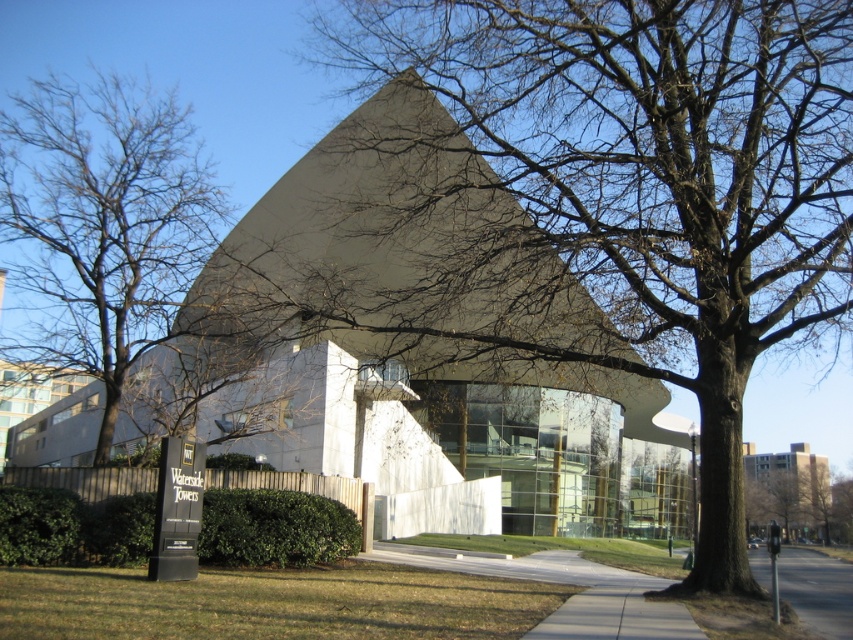
You are a delivery person trying to find the entrance to Waterside Towers. You see the brown textured tree at center and the gray asphalt at lower right. Which object is closer to you?

The brown textured tree at center is closer to you since the gray asphalt at lower right is behind it.

You are a visitor arriving at Waterside Towers and want to park your car on the gray asphalt at lower right. However, there is a brown textured tree at center blocking the path. Is the tree in the way of the parking area?

The brown textured tree at center is located below gray asphalt at lower right, meaning the tree is positioned under the parking area. Since the tree is below the asphalt, it is not blocking the path to the parking area. You can proceed to park your car without any obstruction.

You are a drone operator planning to fly your drone over the Waterside Towers building. You notice two trees in the image. One has bare branches at center and the other is a brown textured tree at center. Which tree should you avoid flying near to prevent interference with your drone?

You should avoid flying near the bare branches at center because it is above the brown textured tree at center, making it closer to the drone flight path.